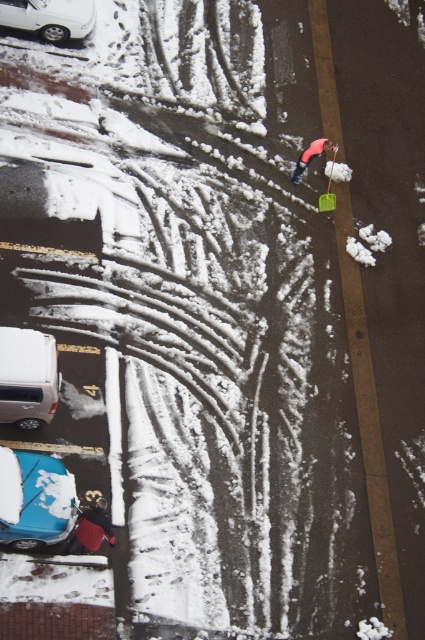
Question: Considering the real-world distances, which object is closest to the red fabric bag at lower left?

Choices:
 (A) red fabric umbrella at upper center
 (B) white matte van at lower left

Answer: (B)

Question: Considering the real-world distances, which object is closest to the white glossy car at upper left?

Choices:
 (A) red fabric umbrella at upper center
 (B) red fabric bag at lower left
 (C) blue matte car at lower left

Answer: (A)

Question: Does white matte van at lower left appear under red fabric bag at lower left?

Choices:
 (A) yes
 (B) no

Answer: (B)

Question: Does white glossy car at upper left appear on the left side of red fabric umbrella at upper center?

Choices:
 (A) yes
 (B) no

Answer: (A)

Question: Among these points, which one is farthest from the camera?

Choices:
 (A) (104, 529)
 (B) (11, 406)

Answer: (B)

Question: Can you confirm if white glossy car at upper left is positioned to the right of red fabric bag at lower left?

Choices:
 (A) yes
 (B) no

Answer: (B)